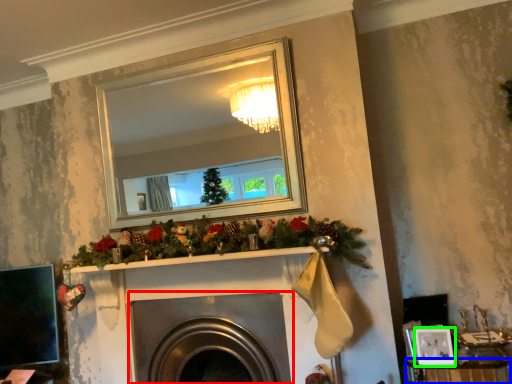
Question: Based on their relative distances, which object is farther from fireplace (highlighted by a red box)? Choose from furniture (highlighted by a blue box) and picture frame (highlighted by a green box).

Choices:
 (A) furniture
 (B) picture frame

Answer: (B)